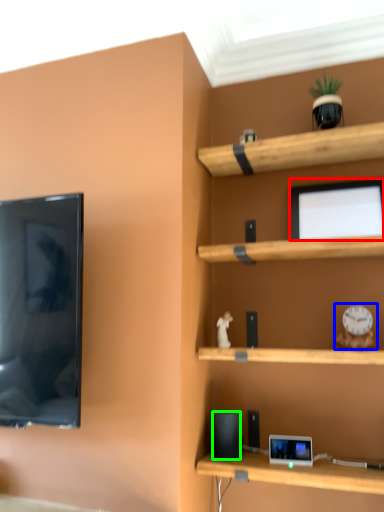
Question: Which object is the farthest from computer monitor (highlighted by a red box)? Choose among these: toy (highlighted by a blue box) or speaker (highlighted by a green box).

Choices:
 (A) toy
 (B) speaker

Answer: (B)